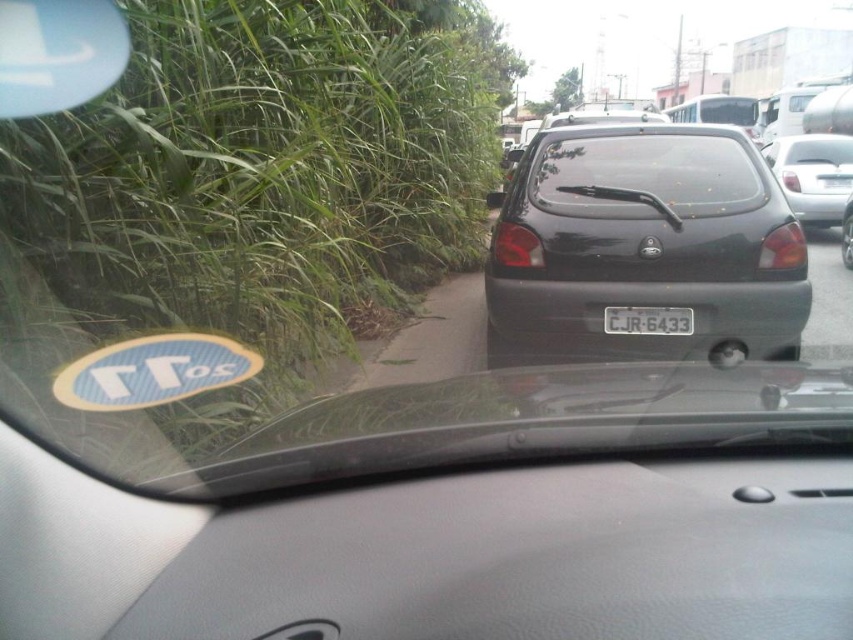
Is matte black hatchback at center above black matte hatchback at right?

No, matte black hatchback at center is not above black matte hatchback at right.

Can you confirm if matte black hatchback at center is shorter than black matte hatchback at right?

No.

The width and height of the screenshot is (853, 640). In order to click on matte black hatchback at center in this screenshot , I will do `click(646, 243)`.

Is green grass at upper left positioned in front of transparent glass windshield at center?

That is False.

Is green grass at upper left further to camera compared to transparent glass windshield at center?

Yes, green grass at upper left is further from the viewer.

Locate an element on the screen. green grass at upper left is located at coordinates (221, 192).

At what (x,y) coordinates should I click in order to perform the action: click on matte black hatchback at center. Please return your answer as a coordinate pair (x, y). Looking at the image, I should click on (646, 243).

From the picture: Between matte black hatchback at center and white plastic license plate at center, which one is positioned higher?

matte black hatchback at center is above.

Which is behind, point (544, 252) or point (613, 310)?

Point (544, 252)

What are the coordinates of `matte black hatchback at center` in the screenshot? It's located at click(x=646, y=243).